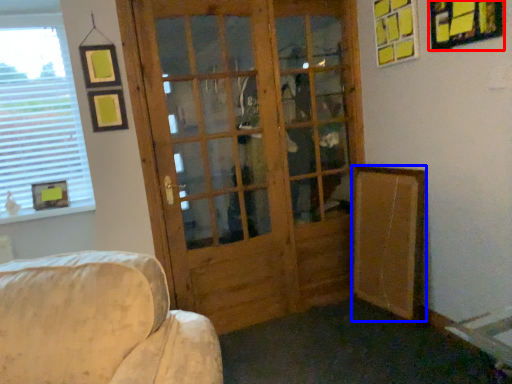
Question: Among these objects, which one is nearest to the camera, picture frame (highlighted by a red box) or bulletin board (highlighted by a blue box)?

Choices:
 (A) picture frame
 (B) bulletin board

Answer: (A)